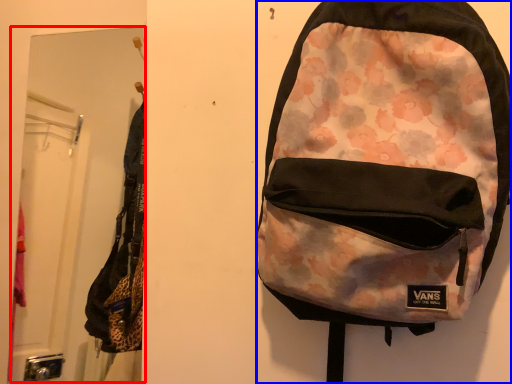
Question: Which of the following is the farthest to the observer, mirror (highlighted by a red box) or backpack (highlighted by a blue box)?

Choices:
 (A) mirror
 (B) backpack

Answer: (A)